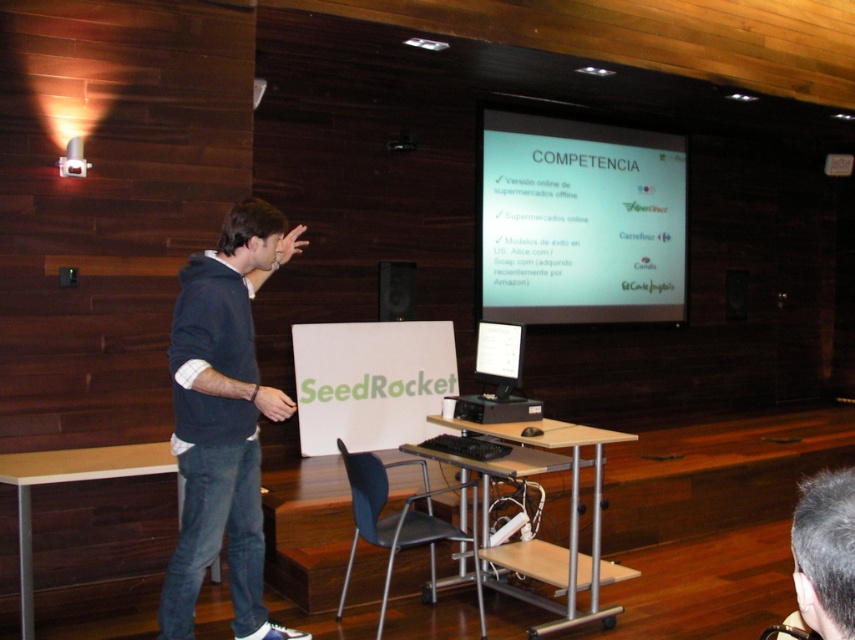
Does dark blue hoodie at left lie behind matte black speaker at upper center?

No, it is in front of matte black speaker at upper center.

Which is in front, point (189, 628) or point (388, 310)?

Positioned in front is point (189, 628).

Where is `dark blue hoodie at left`? This screenshot has height=640, width=855. dark blue hoodie at left is located at coordinates (223, 419).

Between white matte projector screen at upper center and dark blue hoodie at left, which one has more height?

dark blue hoodie at left

Find the location of a particular element. white matte projector screen at upper center is located at coordinates (579, 221).

Does white matte projector screen at upper center come behind matte black speaker at upper center?

Yes, white matte projector screen at upper center is behind matte black speaker at upper center.

Which is above, white matte projector screen at upper center or matte black speaker at upper center?

white matte projector screen at upper center

Is point (481, 291) closer to camera compared to point (382, 291)?

No, (481, 291) is further to viewer.

At what (x,y) coordinates should I click in order to perform the action: click on white matte projector screen at upper center. Please return your answer as a coordinate pair (x, y). Looking at the image, I should click on (579, 221).